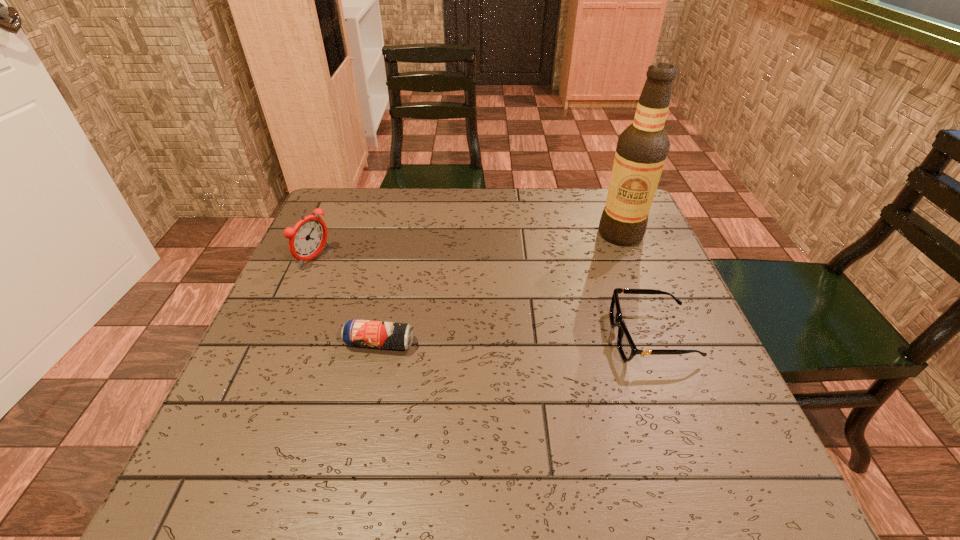
Where is `vacant space at the far edge`? Image resolution: width=960 pixels, height=540 pixels. vacant space at the far edge is located at coordinates (566, 222).

Find the location of a particular element. This screenshot has width=960, height=540. free space at the near edge is located at coordinates (317, 431).

In the image, there is a desktop. At what (x,y) coordinates should I click in order to perform the action: click on vacant space at the left edge. Please return your answer as a coordinate pair (x, y). This screenshot has width=960, height=540. Looking at the image, I should click on (307, 369).

I want to click on free spot at the right edge of the desktop, so click(669, 292).

You are a GUI agent. You are given a task and a screenshot of the screen. Output one action in this format:
    pyautogui.click(x=<x>, y=<y>)
    Task: Click on the vacant space at the far left corner of the desktop
    
    Given the screenshot: What is the action you would take?
    pyautogui.click(x=357, y=218)

Locate an element on the screen. The width and height of the screenshot is (960, 540). blank space at the near left corner of the desktop is located at coordinates (308, 412).

Locate an element on the screen. The image size is (960, 540). free space between the tallest object and the sunglasses is located at coordinates (636, 285).

Locate an element on the screen. The height and width of the screenshot is (540, 960). free space between the sunglasses and the beer can is located at coordinates (516, 340).

This screenshot has width=960, height=540. I want to click on free space between the tallest object and the sunglasses, so click(636, 285).

Identify the location of blank region between the alarm clock and the alcohol. Image resolution: width=960 pixels, height=540 pixels. (468, 246).